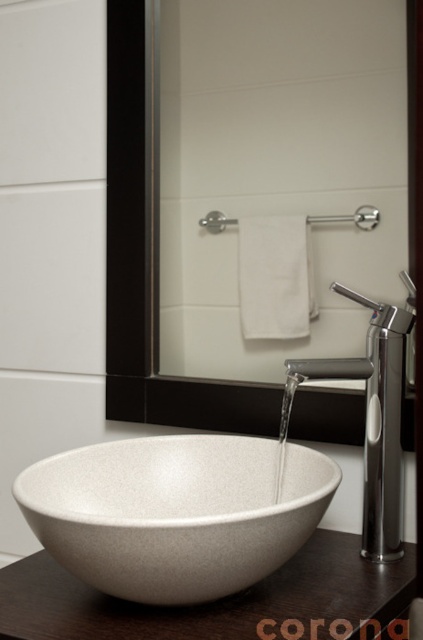
Question: Which object is positioned farthest from the brown wood countertop at lower center?

Choices:
 (A) polished metallic faucet at center
 (B) white speckled stone sink at center
 (C) silver metallic towel bar at upper center

Answer: (C)

Question: Observing the image, what is the correct spatial positioning of white matte towel at upper center in reference to silver metallic towel bar at upper center?

Choices:
 (A) right
 (B) left

Answer: (B)

Question: From the image, what is the correct spatial relationship of white speckled stone sink at center in relation to brown wood countertop at lower center?

Choices:
 (A) left
 (B) right

Answer: (A)

Question: Which of these objects is positioned farthest from the white speckled stone sink at center?

Choices:
 (A) white matte towel at upper center
 (B) silver metallic towel bar at upper center
 (C) polished metallic faucet at center
 (D) brown wood countertop at lower center

Answer: (B)

Question: Among these points, which one is farthest from the camera?

Choices:
 (A) (307, 134)
 (B) (400, 376)

Answer: (A)

Question: From the image, what is the correct spatial relationship of white speckled stone sink at center in relation to silver metallic towel bar at upper center?

Choices:
 (A) above
 (B) below

Answer: (B)